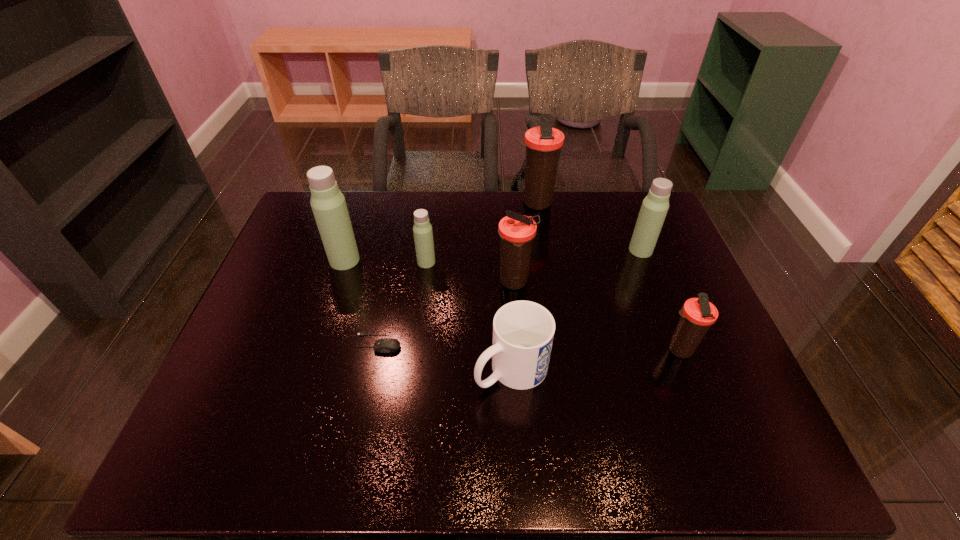
This screenshot has height=540, width=960. What are the coordinates of `free space located on the left of the seventh object from right to left` in the screenshot? It's located at (303, 343).

The width and height of the screenshot is (960, 540). I want to click on object situated at the far edge, so click(543, 144).

Find the location of `object at the left edge`. object at the left edge is located at coordinates (328, 204).

Find the location of a particular element. The width and height of the screenshot is (960, 540). free region at the far edge of the desktop is located at coordinates (586, 202).

This screenshot has height=540, width=960. Identify the location of vacant space at the near edge of the desktop. (612, 450).

This screenshot has height=540, width=960. In the image, there is a desktop. What are the coordinates of `vacant space at the left edge` in the screenshot? It's located at (253, 347).

Find the location of a particular element. vacant space at the right edge is located at coordinates (640, 264).

Locate an element on the screen. This screenshot has width=960, height=540. vacant space at the far left corner of the desktop is located at coordinates (305, 202).

In the image, there is a desktop. What are the coordinates of `vacant space at the near left corner` in the screenshot? It's located at (242, 448).

The width and height of the screenshot is (960, 540). I want to click on free location at the far right corner, so click(x=615, y=213).